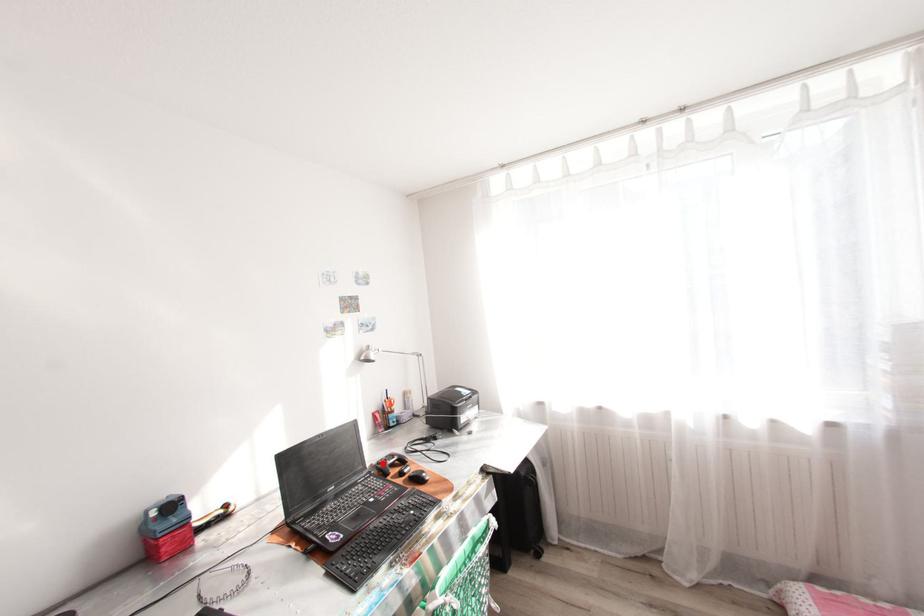
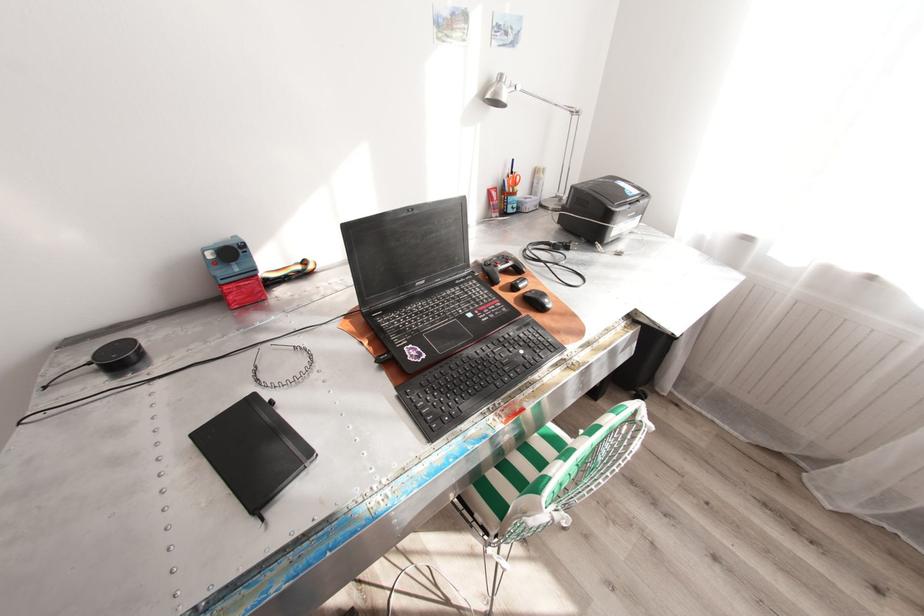
In the second image, find the point that corresponds to the highlighted location in the first image.

(490, 264)